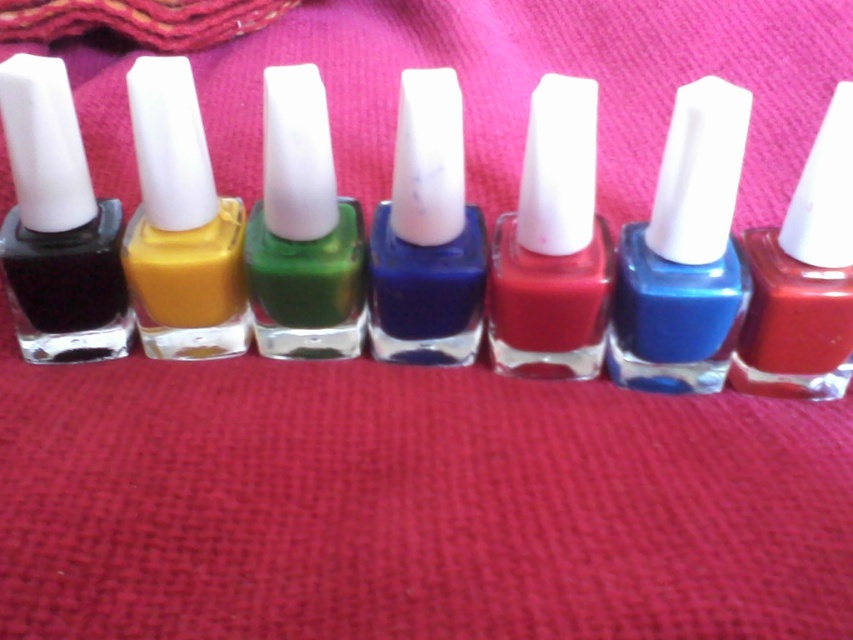
Question: Estimate the real-world distances between objects in this image. Which object is farther from the matte black nail polish at left?

Choices:
 (A) matte blue nail polish at center
 (B) matte yellow nail polish at center
 (C) shiny blue nail polish at center

Answer: (C)

Question: Where is matte yellow nail polish at center located in relation to matte blue nail polish at center in the image?

Choices:
 (A) left
 (B) right

Answer: (A)

Question: Can you confirm if matte yellow nail polish at center is bigger than matte blue nail polish at center?

Choices:
 (A) no
 (B) yes

Answer: (A)

Question: Among these objects, which one is nearest to the camera?

Choices:
 (A) matte yellow nail polish at center
 (B) matte blue nail polish at center
 (C) shiny blue nail polish at center
 (D) matte black nail polish at left

Answer: (C)

Question: Is matte black nail polish at left further to the viewer compared to matte blue nail polish at center?

Choices:
 (A) no
 (B) yes

Answer: (B)

Question: Which point is closer to the camera taking this photo?

Choices:
 (A) (229, 330)
 (B) (431, 177)
 (C) (735, 269)
 (D) (10, 150)

Answer: (B)